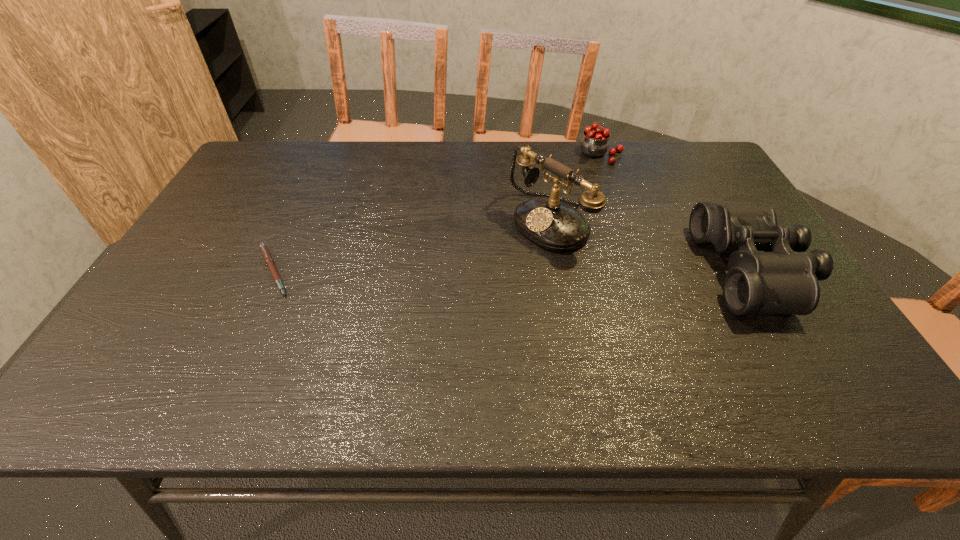
Where is `free space between the second object from left to right and the leftmost object`? free space between the second object from left to right and the leftmost object is located at coordinates (411, 247).

Where is `free spot between the binoculars and the telephone`? The height and width of the screenshot is (540, 960). free spot between the binoculars and the telephone is located at coordinates (651, 246).

What are the coordinates of `free space between the farthest object and the tallest object` in the screenshot? It's located at 574,188.

Find the location of a particular element. The height and width of the screenshot is (540, 960). blank region between the leftmost object and the second object from left to right is located at coordinates (411, 247).

Identify the location of empty location between the shortest object and the farthest object. pyautogui.click(x=436, y=213).

At what (x,y) coordinates should I click in order to perform the action: click on empty space between the rightmost object and the third object from right to left. Please return your answer as a coordinate pair (x, y). The image size is (960, 540). Looking at the image, I should click on (651, 246).

Locate an element on the screen. This screenshot has height=540, width=960. vacant area that lies between the third object from left to right and the telephone is located at coordinates (574, 188).

What are the coordinates of `object that stands as the closest to the rightmost object` in the screenshot? It's located at (545, 220).

Locate which object is the third closest to the pot filled with cherries. Please provide its 2D coordinates. Your answer should be formatted as a tuple, i.e. [(x, y)], where the tuple contains the x and y coordinates of a point satisfying the conditions above.

[(265, 252)]

Image resolution: width=960 pixels, height=540 pixels. Find the location of `blank space that satisfies the following two spatial constraints: 1. on the front side of the binoculars; 2. at the eyepieces of the farthest object`. blank space that satisfies the following two spatial constraints: 1. on the front side of the binoculars; 2. at the eyepieces of the farthest object is located at coordinates (640, 270).